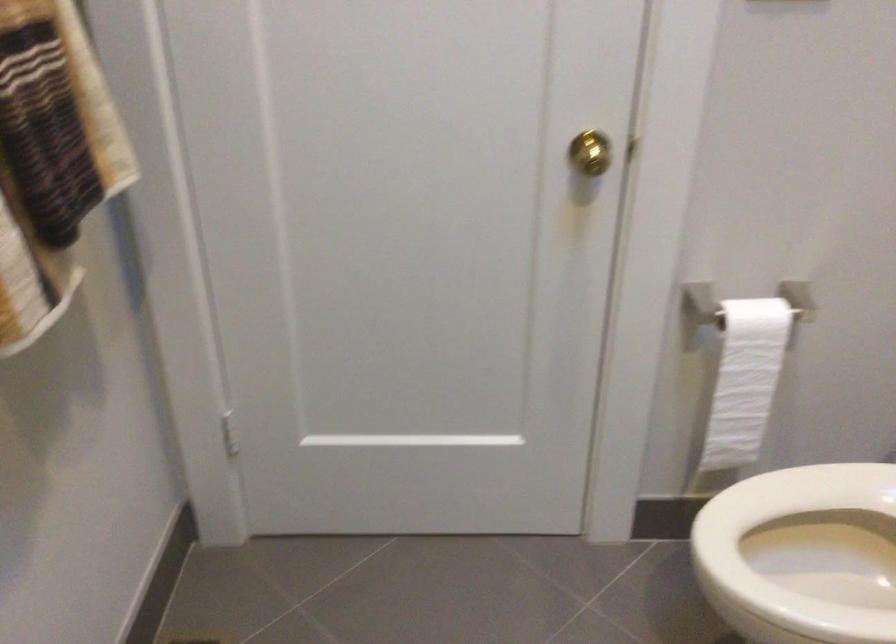
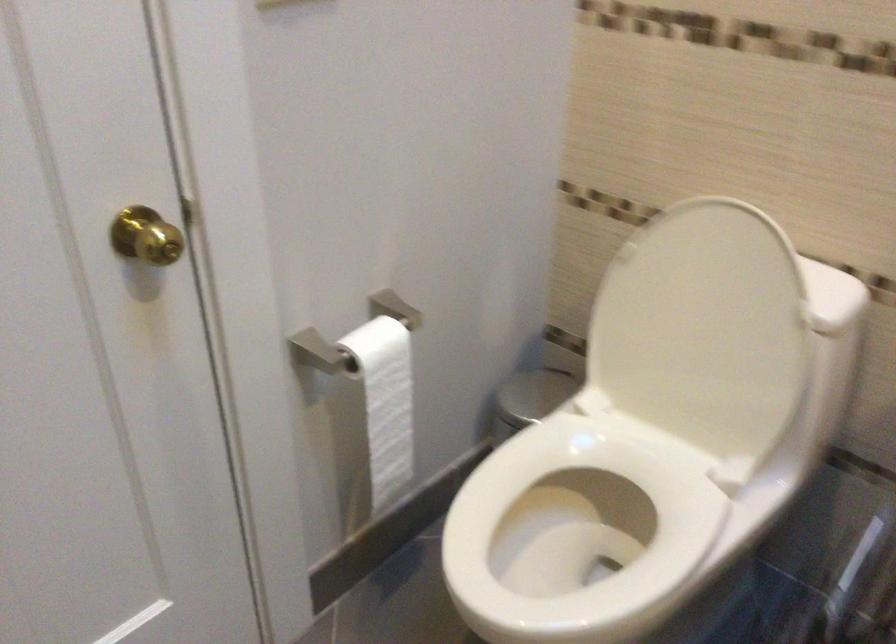
Question: The camera is either moving clockwise (left) or counter-clockwise (right) around the object. The first image is from the beginning of the video and the second image is from the end. Is the camera moving left or right when shooting the video?

Choices:
 (A) Left
 (B) Right

Answer: (A)